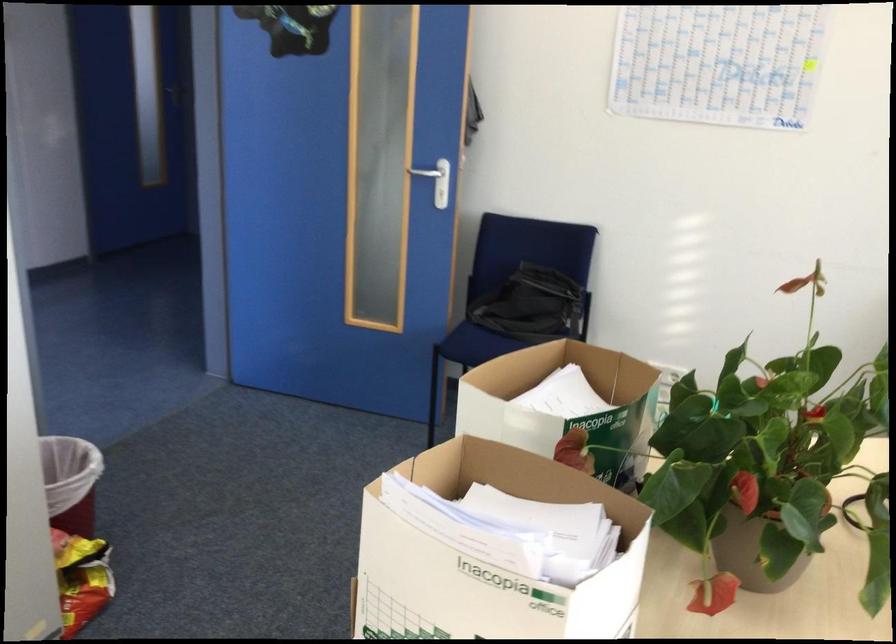
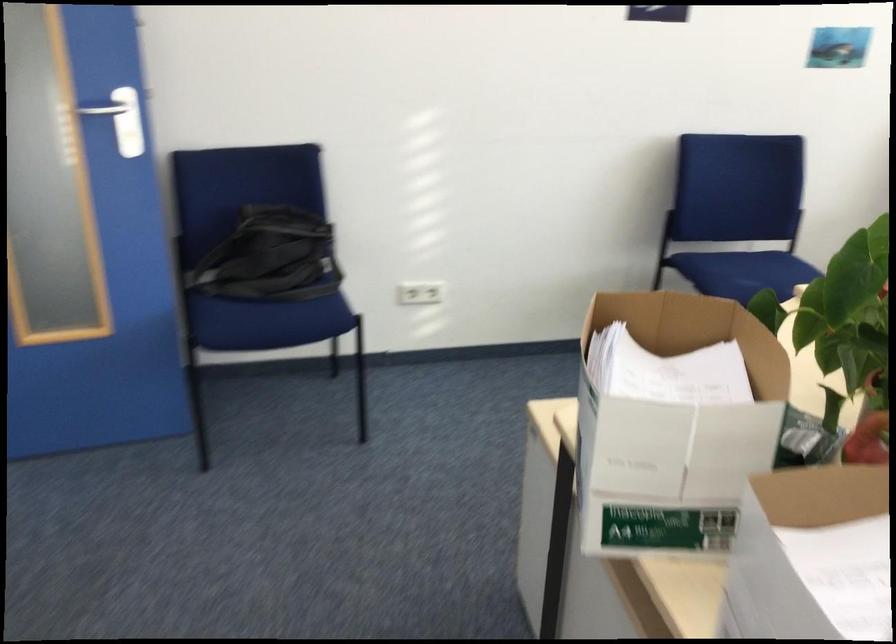
Question: The camera is either moving clockwise (left) or counter-clockwise (right) around the object. The first image is from the beginning of the video and the second image is from the end. Is the camera moving left or right when shooting the video?

Choices:
 (A) Left
 (B) Right

Answer: (A)